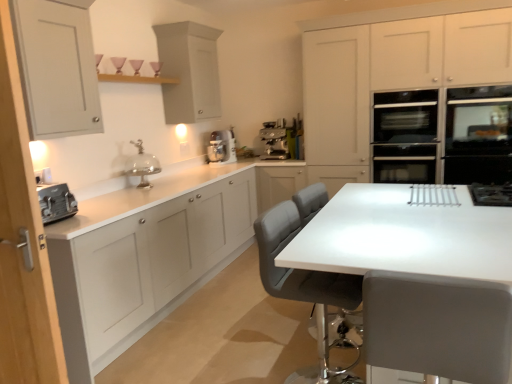
Question: Is matte gray chair at center, arranged as the 1th chair when viewed from the front, completely or partially inside satin silver espresso machine at center?

Choices:
 (A) no
 (B) yes

Answer: (A)

Question: Does satin silver espresso machine at center come in front of matte gray chair at center, the second chair from the back?

Choices:
 (A) no
 (B) yes

Answer: (A)

Question: Is satin silver espresso machine at center facing towards matte gray chair at center, arranged as the 1th chair when viewed from the front?

Choices:
 (A) no
 (B) yes

Answer: (A)

Question: Is satin silver espresso machine at center at the left side of matte gray chair at center, the second chair from the back?

Choices:
 (A) no
 (B) yes

Answer: (B)

Question: Considering the relative sizes of satin silver espresso machine at center and matte gray chair at center, arranged as the 1th chair when viewed from the front, in the image provided, is satin silver espresso machine at center thinner than matte gray chair at center, arranged as the 1th chair when viewed from the front,?

Choices:
 (A) yes
 (B) no

Answer: (A)

Question: From a real-world perspective, is satin silver espresso machine at center located higher than matte gray chair at center, the second chair from the back?

Choices:
 (A) yes
 (B) no

Answer: (A)

Question: From a real-world perspective, is black glass oven at right, acting as the first oven starting from the right, below silver metallic cake stand at center?

Choices:
 (A) yes
 (B) no

Answer: (A)

Question: Can you see black glass oven at right, the 2th oven viewed from the left, touching silver metallic cake stand at center?

Choices:
 (A) yes
 (B) no

Answer: (B)

Question: Would you say silver metallic cake stand at center is part of black glass oven at right, the 2th oven viewed from the left,'s contents?

Choices:
 (A) yes
 (B) no

Answer: (B)

Question: Is black glass oven at right, acting as the first oven starting from the right, turned away from silver metallic cake stand at center?

Choices:
 (A) yes
 (B) no

Answer: (B)

Question: Is black glass oven at right, acting as the first oven starting from the right, located outside silver metallic cake stand at center?

Choices:
 (A) no
 (B) yes

Answer: (B)

Question: Considering the relative sizes of gray leather chair at center, marked as the 1th chair in a back-to-front arrangement, and matte white toaster at left, which is the second cabinetry in left-to-right order, in the image provided, is gray leather chair at center, marked as the 1th chair in a back-to-front arrangement, smaller than matte white toaster at left, which is the second cabinetry in left-to-right order,?

Choices:
 (A) yes
 (B) no

Answer: (B)